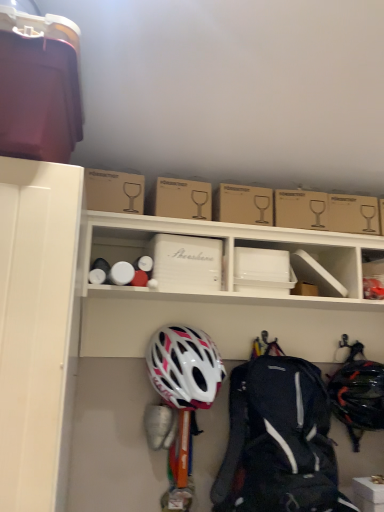
Question: Is black matte helmet at lower right, acting as the 2th helmet starting from the left, positioned far away from white matte helmet at center, marked as the first helmet in a left-to-right arrangement?

Choices:
 (A) no
 (B) yes

Answer: (A)

Question: From a real-world perspective, does black matte helmet at lower right, the 1th helmet when ordered from right to left, sit lower than white matte helmet at center, marked as the first helmet in a left-to-right arrangement?

Choices:
 (A) yes
 (B) no

Answer: (A)

Question: Is black matte helmet at lower right, acting as the 2th helmet starting from the left, taller than white matte helmet at center, the 2th helmet when ordered from right to left?

Choices:
 (A) no
 (B) yes

Answer: (B)

Question: Is black matte helmet at lower right, acting as the 2th helmet starting from the left, to the right of white matte helmet at center, marked as the first helmet in a left-to-right arrangement, from the viewer's perspective?

Choices:
 (A) no
 (B) yes

Answer: (B)

Question: Can you confirm if black matte helmet at lower right, acting as the 2th helmet starting from the left, is positioned to the left of white matte helmet at center, marked as the first helmet in a left-to-right arrangement?

Choices:
 (A) no
 (B) yes

Answer: (A)

Question: Is black matte helmet at lower right, the 1th helmet when ordered from right to left, touching white matte helmet at center, the 2th helmet when ordered from right to left?

Choices:
 (A) no
 (B) yes

Answer: (A)

Question: From a real-world perspective, is matte black backpack at center positioned over brown cardboard box at upper center, acting as the first cardboard box starting from the right, based on gravity?

Choices:
 (A) yes
 (B) no

Answer: (B)

Question: From the image's perspective, is matte black backpack at center on top of brown cardboard box at upper center, arranged as the fourth cardboard box when viewed from the left?

Choices:
 (A) yes
 (B) no

Answer: (B)

Question: Could you tell me if matte black backpack at center is facing brown cardboard box at upper center, arranged as the fourth cardboard box when viewed from the left?

Choices:
 (A) yes
 (B) no

Answer: (B)

Question: Considering the relative positions of matte black backpack at center and brown cardboard box at upper center, arranged as the fourth cardboard box when viewed from the left, in the image provided, is matte black backpack at center to the right of brown cardboard box at upper center, arranged as the fourth cardboard box when viewed from the left, from the viewer's perspective?

Choices:
 (A) yes
 (B) no

Answer: (A)

Question: Are matte black backpack at center and brown cardboard box at upper center, arranged as the fourth cardboard box when viewed from the left, located far from each other?

Choices:
 (A) yes
 (B) no

Answer: (B)

Question: Is brown cardboard box at upper center, arranged as the fourth cardboard box when viewed from the left, completely or partially inside matte black backpack at center?

Choices:
 (A) yes
 (B) no

Answer: (B)

Question: Is brown cardboard box at upper center, the 1th cardboard box when ordered from left to right, at the left side of white matte helmet at center, the 2th helmet when ordered from right to left?

Choices:
 (A) yes
 (B) no

Answer: (A)